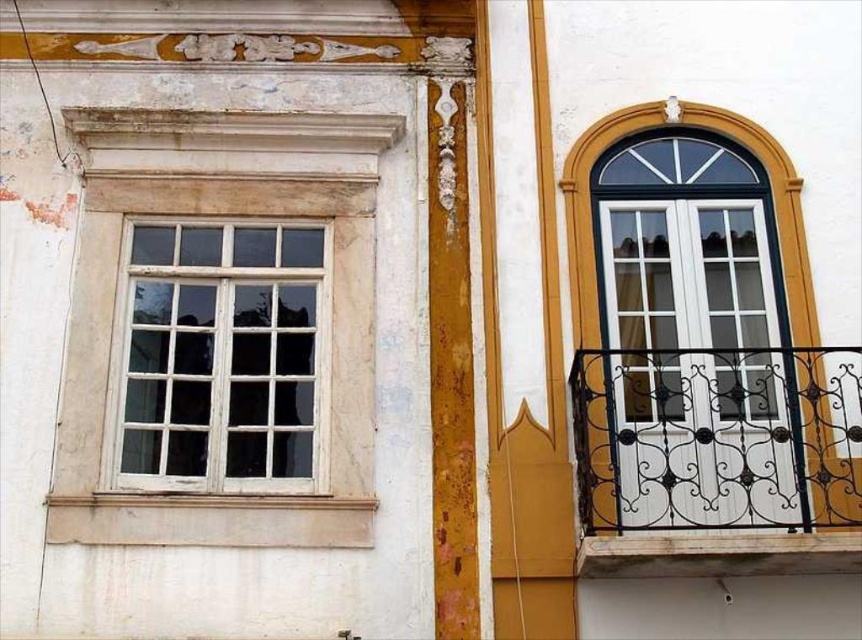
Between white wrought iron balcony at right and white wooden window at left, which one appears on the left side from the viewer's perspective?

white wooden window at left

Can you confirm if white wrought iron balcony at right is taller than white wooden window at left?

In fact, white wrought iron balcony at right may be shorter than white wooden window at left.

Describe the element at coordinates (717, 460) in the screenshot. I see `white wrought iron balcony at right` at that location.

Identify the location of white wrought iron balcony at right. (717, 460).